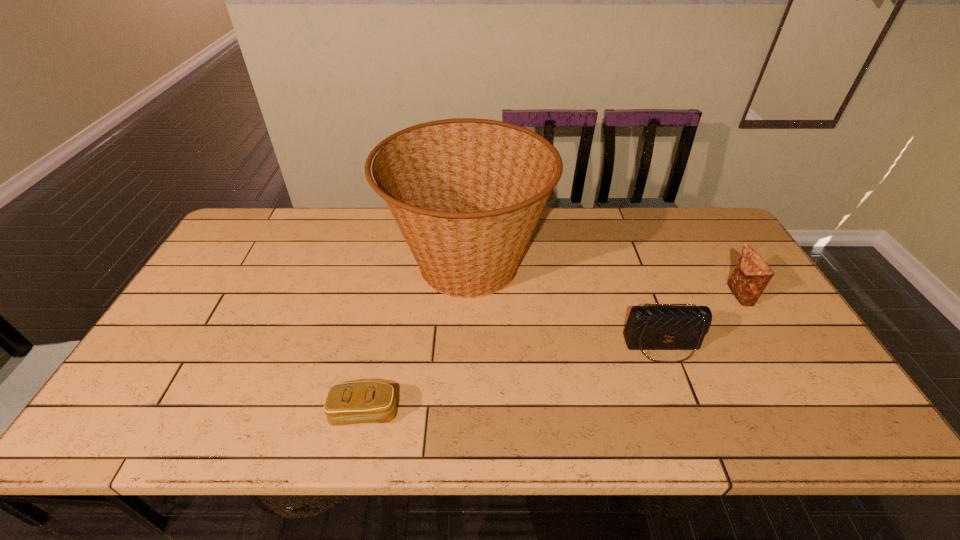
Identify the location of empty location between the tallest object and the rightmost object. This screenshot has width=960, height=540. (603, 280).

Identify the location of vacant space that's between the tallest object and the second object from right to left. (564, 305).

Locate which object is the third closest to the third shortest object. Please provide its 2D coordinates. Your answer should be formatted as a tuple, i.e. [(x, y)], where the tuple contains the x and y coordinates of a point satisfying the conditions above.

[(364, 402)]

Image resolution: width=960 pixels, height=540 pixels. I want to click on the closest object to the leftmost clutch bag, so click(467, 194).

Where is `clutch bag that can be found as the second closest to the second clutch bag from left to right`? clutch bag that can be found as the second closest to the second clutch bag from left to right is located at coordinates (364, 402).

This screenshot has height=540, width=960. Identify the location of clutch bag that is the closest to the second nearest clutch bag. [x=752, y=274].

What are the coordinates of `vacant region that satisfies the following two spatial constraints: 1. on the open side of the farthest clutch bag; 2. on the front flap of the second farthest clutch bag` in the screenshot? It's located at (769, 346).

What are the coordinates of `free space that satisfies the following two spatial constraints: 1. on the open side of the tallest clutch bag; 2. on the zipper side of the nearest clutch bag` in the screenshot? It's located at (810, 413).

Locate an element on the screen. The image size is (960, 540). free space that satisfies the following two spatial constraints: 1. on the open side of the third shortest object; 2. on the front flap of the second clutch bag from left to right is located at coordinates (769, 346).

I want to click on free region that satisfies the following two spatial constraints: 1. on the open side of the farthest clutch bag; 2. on the front flap of the third object from left to right, so click(x=769, y=346).